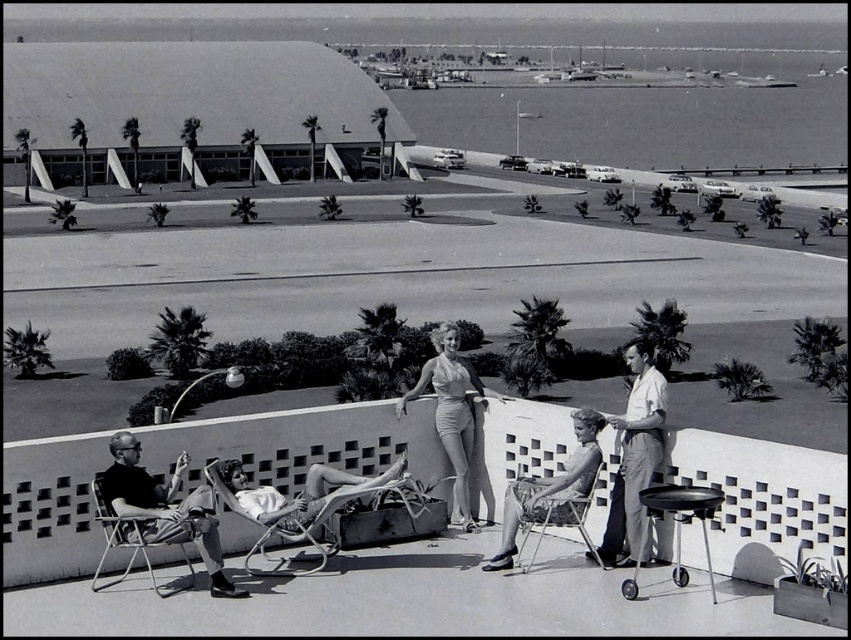
Is light gray fabric chair at lower right bigger than matte white swimsuit at center?

Actually, light gray fabric chair at lower right might be smaller than matte white swimsuit at center.

From the picture: Who is taller, light gray fabric chair at lower right or matte white swimsuit at center?

Standing taller between the two is matte white swimsuit at center.

I want to click on light gray fabric chair at lower right, so click(634, 458).

Does point (467, 422) lie in front of point (553, 522)?

That is False.

Find the location of a particular element. The image size is (851, 640). matte white swimsuit at center is located at coordinates (450, 410).

What do you see at coordinates (164, 508) in the screenshot? I see `dark gray fabric chair at lower left` at bounding box center [164, 508].

Who is more forward, (124, 445) or (644, 371)?

Positioned in front is point (124, 445).

Image resolution: width=851 pixels, height=640 pixels. In order to click on dark gray fabric chair at lower left in this screenshot , I will do `click(164, 508)`.